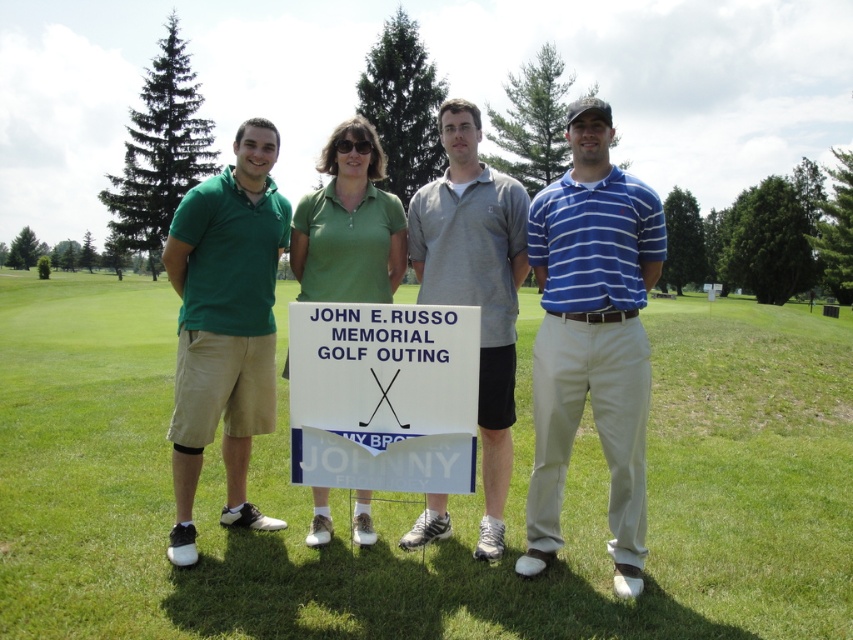
What is the exact location of the white paper sign at center in the image?

The white paper sign at center is located at point coordinates of (383, 396).

You are a photographer at the event and need to adjust the camera focus. The blue striped polo shirt at center and the white paper sign at center are in the frame. Which object is closer to the camera?

The blue striped polo shirt at center and the white paper sign at center are 39.17 inches apart, so the one closer to the camera would depend on their positions. However, since both are at center, it might be challenging to determine without more details. Wait, the description says they are 39.17 inches apart. Since the question is which is closer, but the description only gives the distance between them, not their individual distances from the camera. Hmm, maybe I need to recheck the rules. The answer must

You are a photographer taking a picture of the group. You notice the blue striped polo shirt at center and the white paper sign at center. Which object is taller in the photo?

The blue striped polo shirt at center is taller than the white paper sign at center.